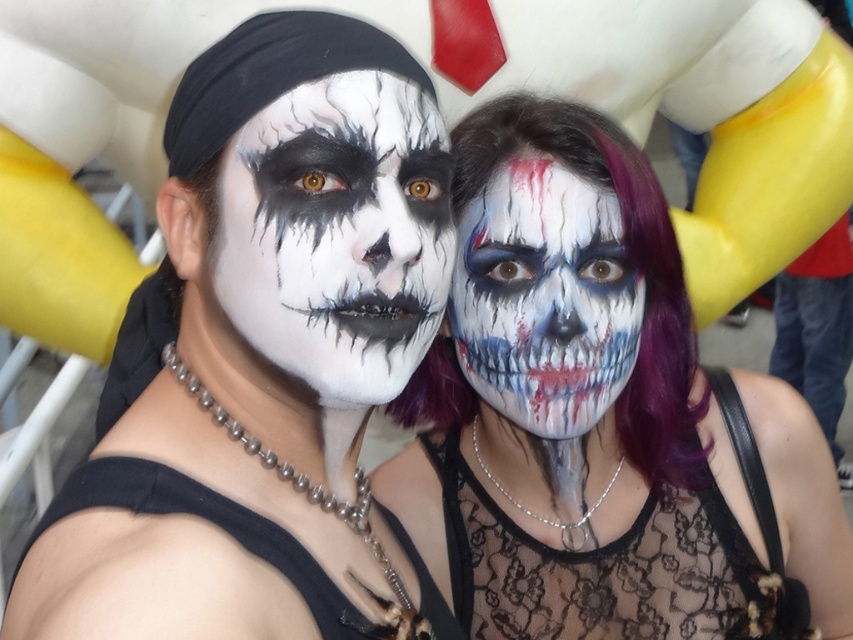
You are a photographer trying to adjust the lighting for a portrait. You notice two central elements in the image, the matte black face paint at center and the matte white skull at center. Which of these elements might require more fill light to ensure proper exposure?

The matte white skull at center requires more fill light because it is smaller than the matte black face paint at center, making it harder to capture detail in the lighter area without overexposing.